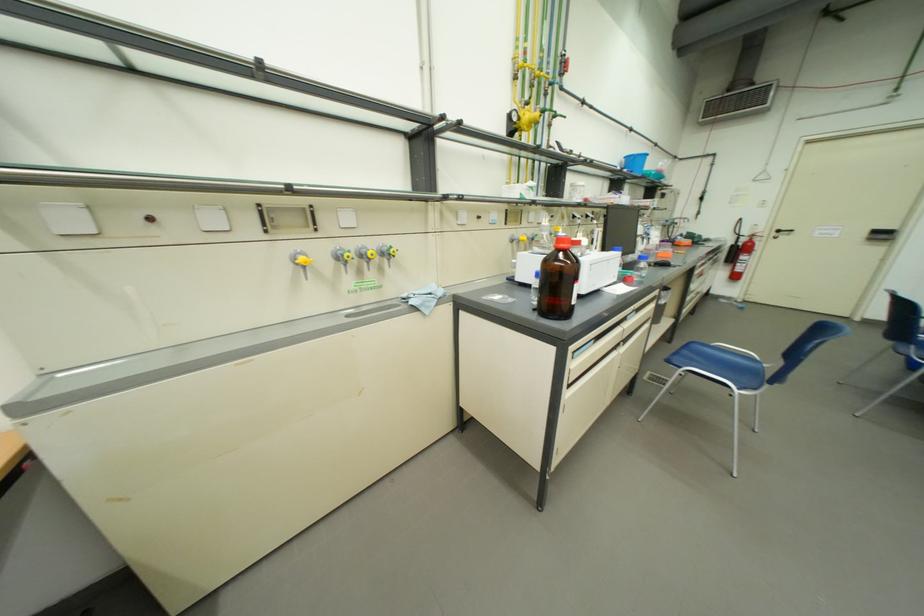
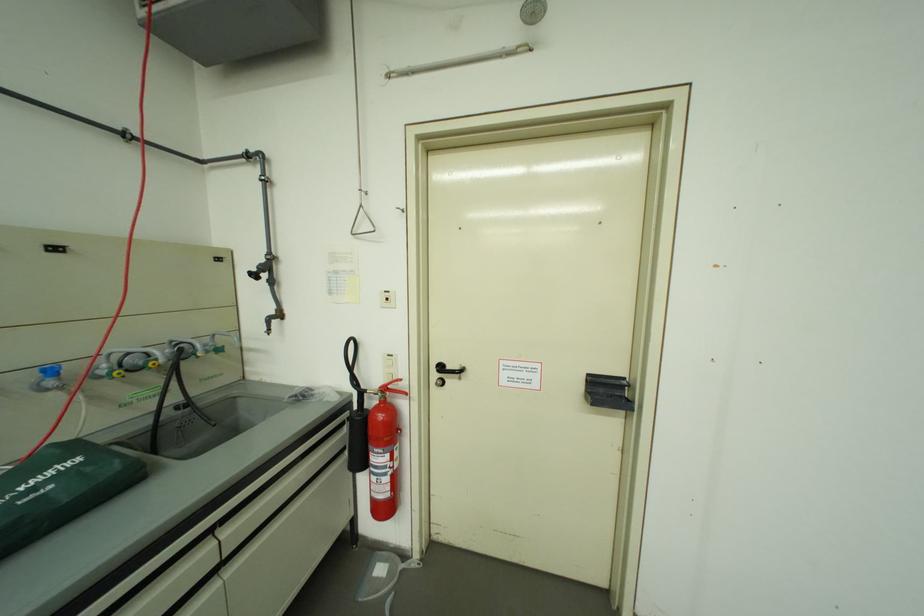
The point at (762, 237) is marked in the first image. Where is the corresponding point in the second image?

(394, 391)